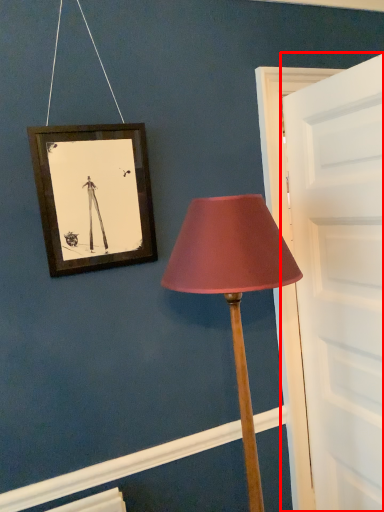
Question: Where is door (annotated by the red box) located in relation to lamp in the image?

Choices:
 (A) left
 (B) right

Answer: (B)